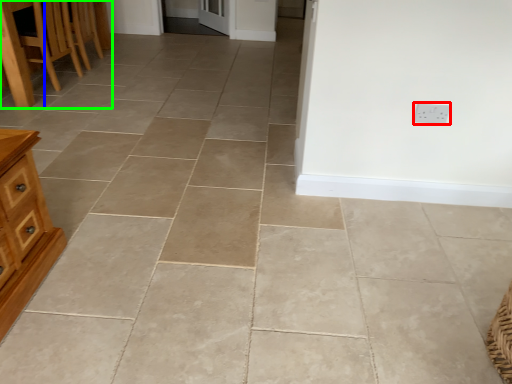
Question: Based on their relative distances, which object is farther from electric outlet (highlighted by a red box)? Choose from table (highlighted by a blue box) and furniture (highlighted by a green box).

Choices:
 (A) table
 (B) furniture

Answer: (B)